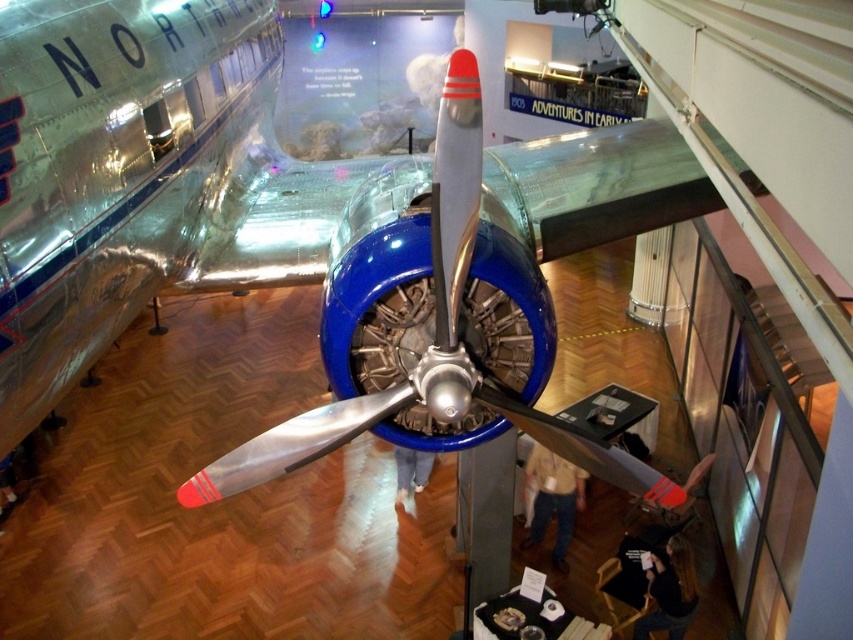
You are a photographer standing in front of the polished aluminum airplane at center. You want to take a closeup shot of the propeller blades. Is the distance between you and the airplane sufficient to allow you to focus on the propeller blades clearly?

The polished aluminum airplane at center is 1.42 meters away from the camera. Most standard camera lenses have a minimum focusing distance of about 0.3 meters, so 1.42 meters is more than enough to focus clearly on the propeller blades.

Looking at this image, you are standing at the camera position and want to pick up an object located at point (30, 380). If your arm can reach 1.6 meters, can you reach it?

The distance between you and the point (30, 380) is 1.67 meters, which is longer than your arm reach of 1.6 meters. Therefore, you cannot reach it.

Based on the photo, you are a museum visitor standing in front of the vintage aircraft. You notice two jackets hanging nearby. Which jacket is positioned to the left when looking at the light brown leather jacket at center and the dark brown leather jacket at lower right?

The light brown leather jacket at center is positioned to the left of the dark brown leather jacket at lower right.